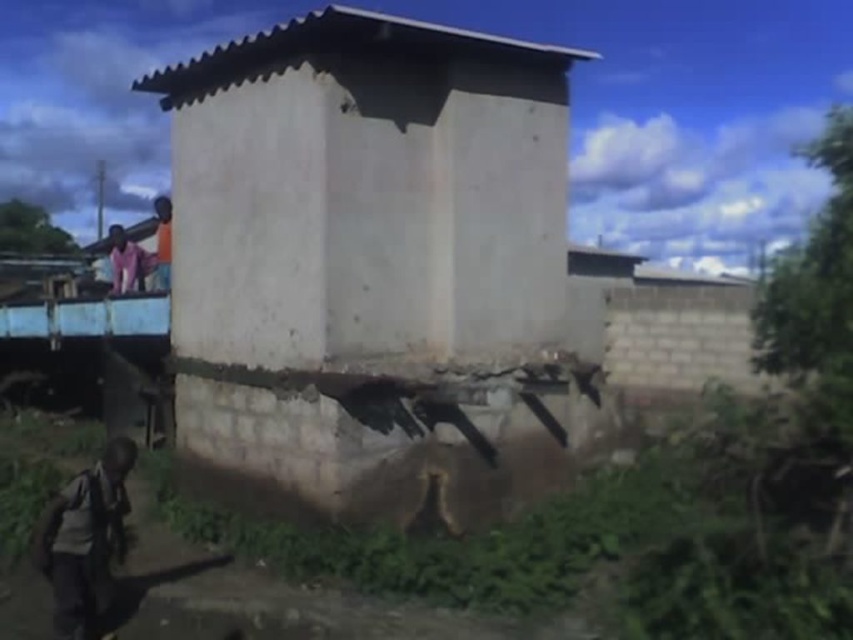
You are standing at the point marked as point (374, 268) in the image. Which object are you standing on?

You are standing on the white concrete hut at center because the point (374, 268) is located on it.